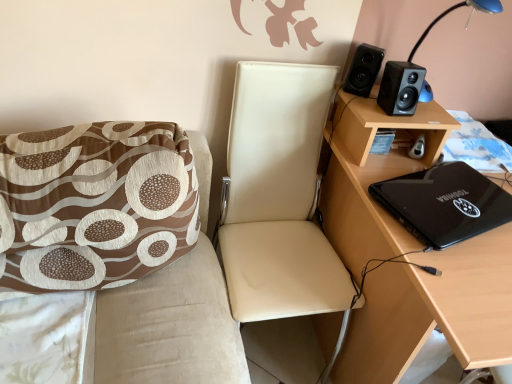
Question: In terms of height, does black plastic table lamp at upper right look taller or shorter compared to leather-like beige chair at center, the 2th chair positioned from the left?

Choices:
 (A) tall
 (B) short

Answer: (B)

Question: Is point (429, 97) closer or farther from the camera than point (293, 127)?

Choices:
 (A) closer
 (B) farther

Answer: (A)

Question: Which of these objects is positioned closest to the black matte speaker at upper right, the 2th speaker viewed from the left?

Choices:
 (A) blue floral fabric at lower right
 (B) black glossy laptop at right
 (C) black plastic table lamp at upper right
 (D) black matte speaker at upper right, the second speaker positioned from the right
 (E) leather-like beige chair at center, the 2th chair positioned from the left

Answer: (D)

Question: Estimate the real-world distances between objects in this image. Which object is closer to the black matte speaker at upper right, arranged as the 1th speaker when viewed from the right?

Choices:
 (A) black matte desk at right
 (B) leather-like beige chair at center, the 2th chair positioned from the left
 (C) brown printed fabric cushion at left, acting as the first chair starting from the left
 (D) black plastic table lamp at upper right
 (E) black matte speaker at upper right, the 1th speaker in the left-to-right sequence

Answer: (E)